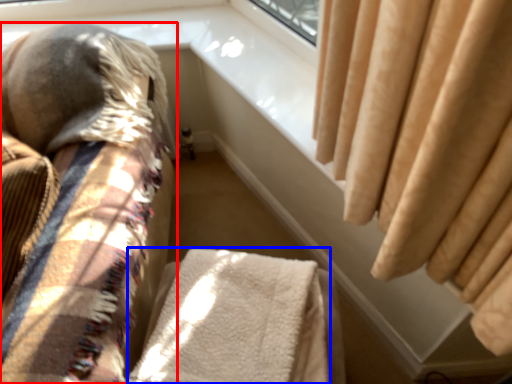
Question: Which object is further to the camera taking this photo, furniture (highlighted by a red box) or blanket (highlighted by a blue box)?

Choices:
 (A) furniture
 (B) blanket

Answer: (B)